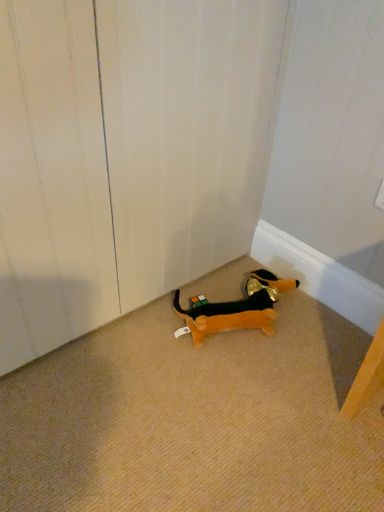
Locate an element on the screen. This screenshot has height=512, width=384. vacant space situated on the left part of velvet orange dog at lower center is located at coordinates (157, 316).